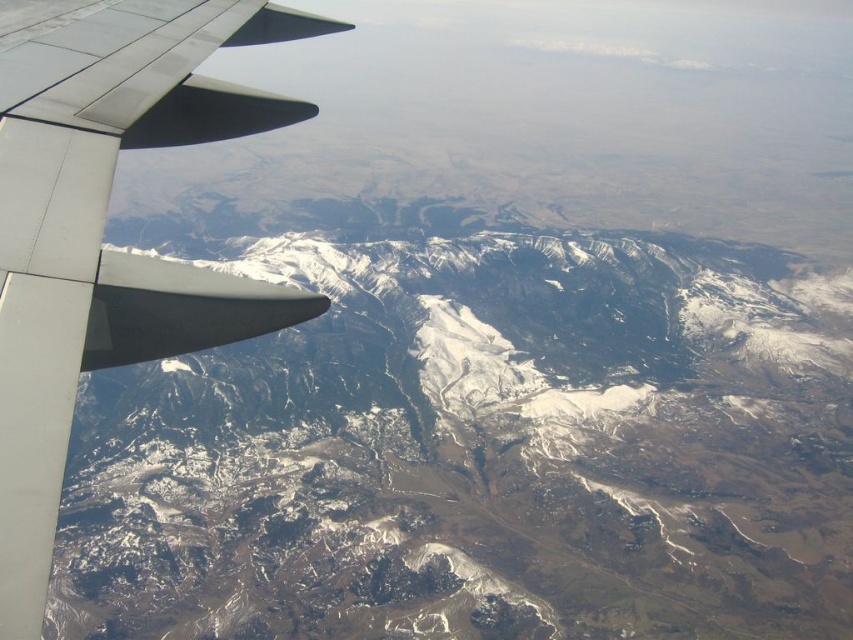
Which of these two, snowy rocky mountain range at upper left or metallic gray wing at left, stands shorter?

metallic gray wing at left

Is snowy rocky mountain range at upper left to the left of metallic gray wing at left from the viewer's perspective?

Incorrect, snowy rocky mountain range at upper left is not on the left side of metallic gray wing at left.

Who is more distant from viewer, (648, 308) or (167, 136)?

Positioned behind is point (648, 308).

At what (x,y) coordinates should I click in order to perform the action: click on snowy rocky mountain range at upper left. Please return your answer as a coordinate pair (x, y). Looking at the image, I should click on (476, 449).